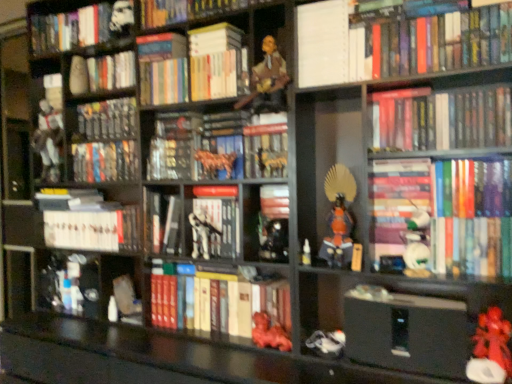
Question: Is hardcover books at upper right, which is the eighth book in top-to-bottom order, behind white matte book at center, the 3th book ordered from the bottom?

Choices:
 (A) yes
 (B) no

Answer: (B)

Question: From a real-world perspective, does hardcover books at upper right, positioned as the eighth book in bottom-to-top order, stand above white matte book at center, the 3th book ordered from the bottom?

Choices:
 (A) no
 (B) yes

Answer: (B)

Question: Is white matte book at center, which appears as the thirteenth book when viewed from the top, located within hardcover books at upper right, which is the eighth book in top-to-bottom order?

Choices:
 (A) no
 (B) yes

Answer: (A)

Question: Does hardcover books at upper right, positioned as the eighth book in bottom-to-top order, turn towards white matte book at center, the 3th book ordered from the bottom?

Choices:
 (A) no
 (B) yes

Answer: (A)

Question: Is hardcover books at upper right, positioned as the eighth book in bottom-to-top order, outside of white matte book at center, which appears as the thirteenth book when viewed from the top?

Choices:
 (A) no
 (B) yes

Answer: (B)

Question: Considering the positions of white matte stormtrooper helmet at upper left, which is counted as the 1th book, starting from the top, and orange matte samurai armor at center, which is the third toy in right-to-left order, in the image, is white matte stormtrooper helmet at upper left, which is counted as the 1th book, starting from the top, bigger or smaller than orange matte samurai armor at center, which is the third toy in right-to-left order,?

Choices:
 (A) big
 (B) small

Answer: (A)

Question: Relative to orange matte samurai armor at center, which is the third toy in right-to-left order, is white matte stormtrooper helmet at upper left, which ranks as the fifteenth book in bottom-to-top order, in front or behind?

Choices:
 (A) front
 (B) behind

Answer: (B)

Question: From the image's perspective, is white matte stormtrooper helmet at upper left, which is counted as the 1th book, starting from the top, located above or below orange matte samurai armor at center, which is the third toy in right-to-left order?

Choices:
 (A) below
 (B) above

Answer: (B)

Question: Is white matte stormtrooper helmet at upper left, which ranks as the fifteenth book in bottom-to-top order, wider or thinner than orange matte samurai armor at center, which is the third toy in right-to-left order?

Choices:
 (A) wide
 (B) thin

Answer: (B)

Question: From the image's perspective, is white matte stormtrooper helmet at upper left, which ranks as the fifteenth book in bottom-to-top order, positioned above or below hardcover book at center right, the tenth book positioned from the top?

Choices:
 (A) below
 (B) above

Answer: (B)

Question: Considering the positions of white matte stormtrooper helmet at upper left, which is counted as the 1th book, starting from the top, and hardcover book at center right, the tenth book positioned from the top, in the image, is white matte stormtrooper helmet at upper left, which is counted as the 1th book, starting from the top, wider or thinner than hardcover book at center right, the tenth book positioned from the top,?

Choices:
 (A) thin
 (B) wide

Answer: (B)

Question: Is point (88, 13) positioned closer to the camera than point (422, 266)?

Choices:
 (A) farther
 (B) closer

Answer: (A)

Question: Considering their positions, is white matte stormtrooper helmet at upper left, which is counted as the 1th book, starting from the top, located in front of or behind hardcover book at center right, which is counted as the 6th book, starting from the bottom?

Choices:
 (A) behind
 (B) front

Answer: (A)

Question: Considering the positions of hardcover book at center right, the tenth book positioned from the top, and rubberized red toy at lower right, the first toy in the right-to-left sequence, in the image, is hardcover book at center right, the tenth book positioned from the top, taller or shorter than rubberized red toy at lower right, the first toy in the right-to-left sequence,?

Choices:
 (A) tall
 (B) short

Answer: (A)

Question: Does point (374, 195) appear closer or farther from the camera than point (496, 314)?

Choices:
 (A) closer
 (B) farther

Answer: (B)